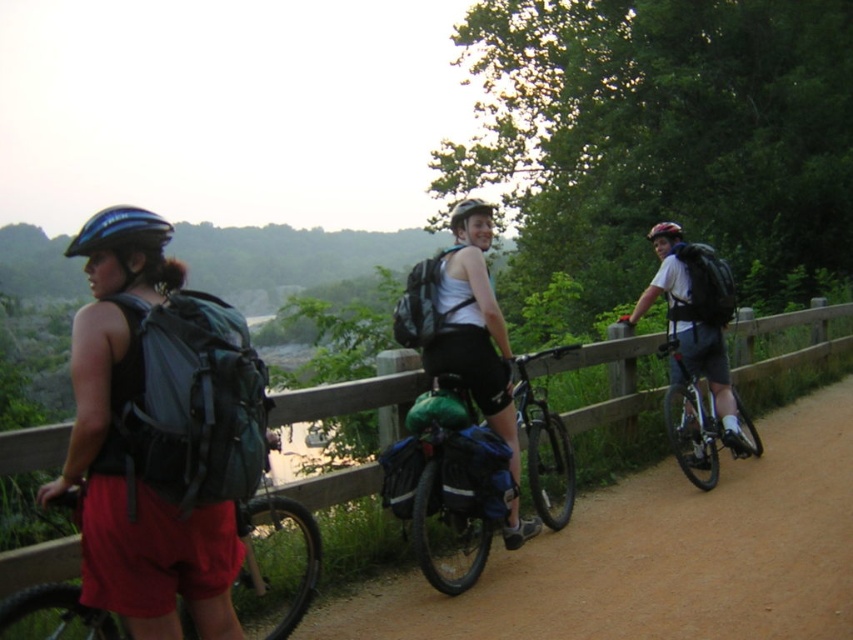
You are a photographer positioned at the origin point of the image coordinate system. You need to capture a photo of the matte black shorts at center. What are the coordinates where you should aim your camera?

The coordinates to aim your camera are at point (x=477, y=348).

You are a photographer trying to capture a candid shot of the cyclists. You want to ensure that both the matte black shorts at center and the matte black helmet at center are in focus. Given that your camera can only focus on objects within a 3 feet range, will both items be in focus?

The matte black shorts at center and matte black helmet at center are 3.28 feet apart from each other. Since the camera can only focus within a 3 feet range, the distance between them exceeds the focus range, so both items cannot be in focus simultaneously.

You are a cyclist on the trail and want to reach the point at coordinates point (541, 497) and point (682, 228). Which point should you head towards first if you want to follow the path in the correct order?

You should head towards point (541, 497) first because it is in front of point (682, 228) along the path.